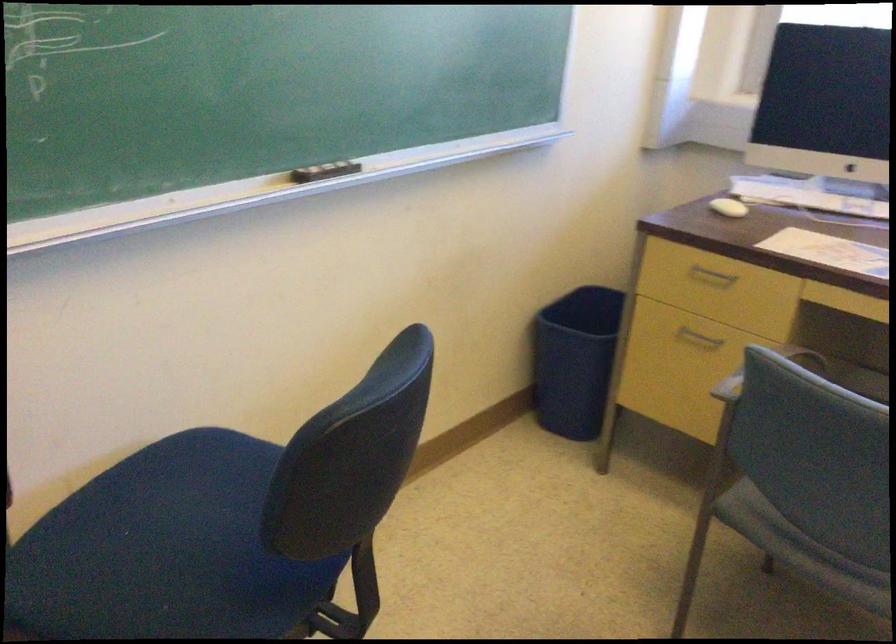
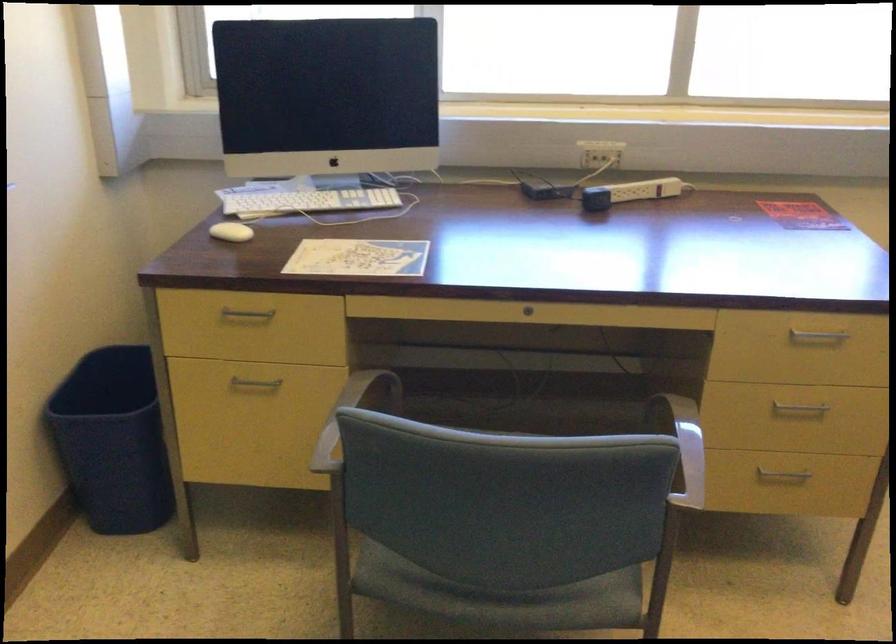
Question: The images are taken continuously from a first-person perspective. In which direction is your viewpoint rotating?

Choices:
 (A) Left
 (B) Right
 (C) Up
 (D) Down

Answer: (B)